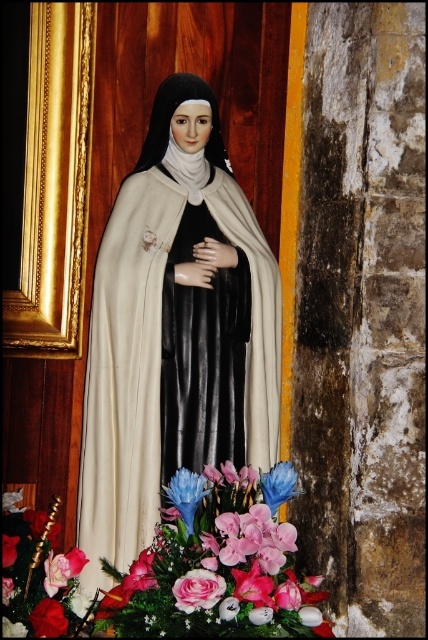
Which is more to the right, blue matte flower at lower center or pink silk flower at lower left?

blue matte flower at lower center

Who is higher up, blue matte flower at lower center or pink silk flower at lower left?

blue matte flower at lower center

The height and width of the screenshot is (640, 428). What do you see at coordinates (187, 493) in the screenshot? I see `blue matte flower at lower center` at bounding box center [187, 493].

Identify the location of blue matte flower at lower center. (187, 493).

Who is lower down, silky fabric bouquet at center or smooth red rose at lower left?

Positioned lower is smooth red rose at lower left.

Which is behind, point (20, 568) or point (55, 634)?

Positioned behind is point (20, 568).

Between point (180, 493) and point (32, 609), which one is positioned behind?

The point (32, 609) is more distant.

At what (x,y) coordinates should I click in order to perform the action: click on silky fabric bouquet at center. Please return your answer as a coordinate pair (x, y). The height and width of the screenshot is (640, 428). Looking at the image, I should click on (208, 568).

Is blue matte flower at lower center further to the viewer compared to smooth red rose at lower left?

That is True.

Does blue matte flower at lower center appear under smooth red rose at lower left?

Incorrect, blue matte flower at lower center is not positioned below smooth red rose at lower left.

From the picture: Who is more forward, (186, 508) or (55, 627)?

Positioned in front is point (55, 627).

Locate an element on the screen. Image resolution: width=428 pixels, height=640 pixels. blue matte flower at lower center is located at coordinates pos(187,493).